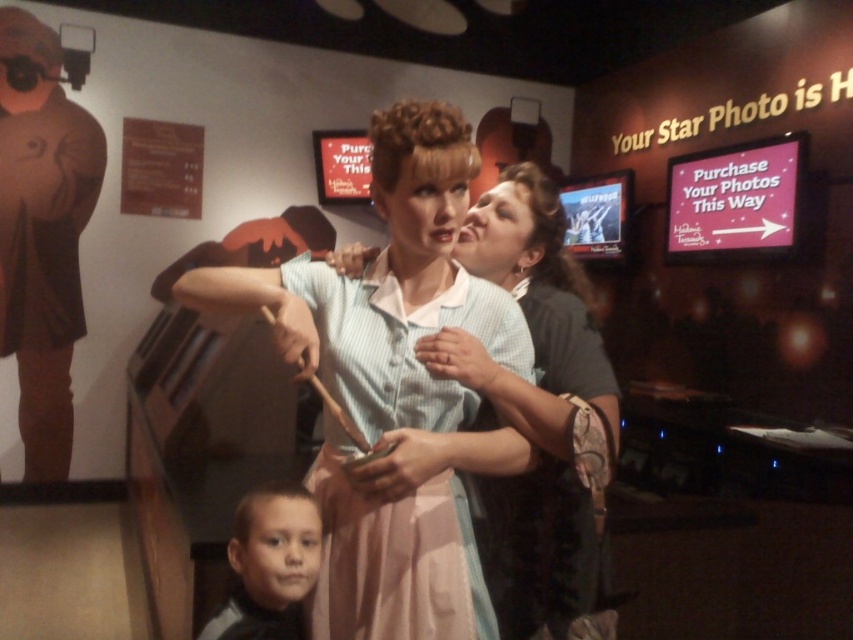
You are standing in front of the wax museum display and want to take a photo that includes both the central woman figure and the child figure. To ensure both are in focus, you need to know which point is closer to the camera. Which point between point (363, 520) and point (267, 596) is closer to the camera?

Point (363, 520) is closer to the camera than point (267, 596) according to the description.

You are a museum guide who needs to arrange a new exhibit. You have a display case that is 1 meter wide. The light blue fabric dress at center and the smooth skin face at lower left need to be placed inside. Can both fit side by side without overlapping?

The light blue fabric dress at center is wider than the smooth skin face at lower left. However, since the display case is 1 meter wide, we need to know the exact widths of both items to determine if they can fit together. Unfortunately, the provided information only states that the dress is wider than the face but does not specify their actual measurements. Therefore, it is uncertain if they can fit side by side without overlapping.

In the wax museum scene, you notice the light blue fabric dress at center and the smooth skin face at lower left. Which object is taller?

The light blue fabric dress at center is taller than the smooth skin face at lower left.